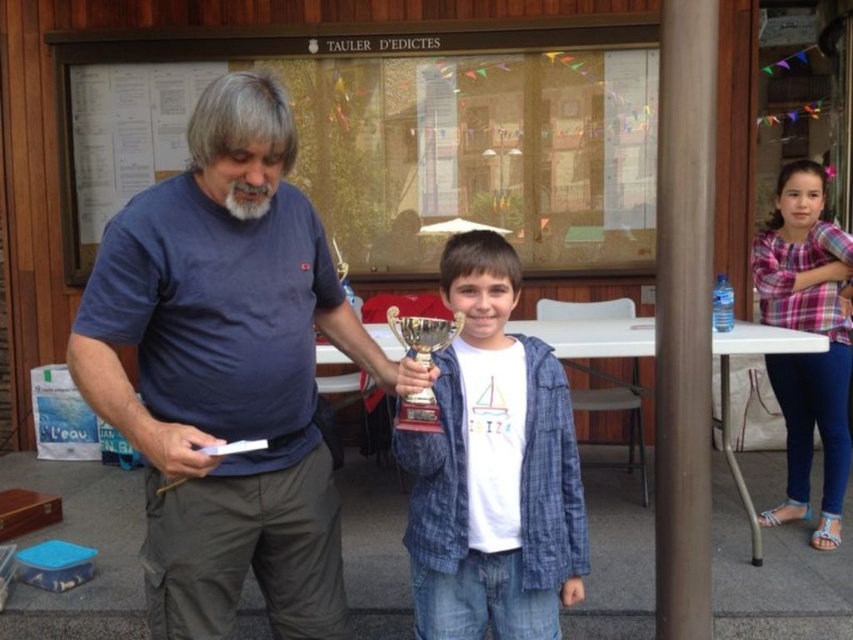
You are an observer standing in front of the wooden structure. You see the plaid shirt at right and the gold metallic trophy at center. Which object is positioned lower in the scene?

The plaid shirt at right is positioned below the gold metallic trophy at center, so the plaid shirt at right is lower.

You are organizing a small event and need to place both the blue cotton shirt at center and the gold metallic trophy at center on a narrow shelf. Based on their sizes, which item should you place first to ensure both fit?

The blue cotton shirt at center is wider than the gold metallic trophy at center, so you should place the gold metallic trophy at center first to accommodate the wider shirt afterward.

You are a photographer at the event and need to capture a photo where both the white matte trophy at center and the grayhairbeard at center are clearly visible. Based on their positions, which one should you focus on first to ensure both are in frame?

The white matte trophy at center is located below the grayhairbeard at center, so focusing on the grayhairbeard at center first will ensure the trophy is also in the frame below it.